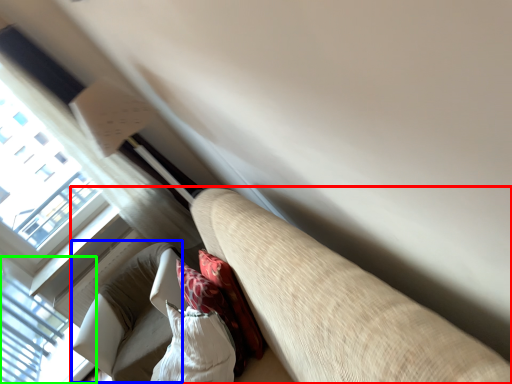
Question: Estimate the real-world distances between objects in this image. Which object is farther from studio couch (highlighted by a red box), bean bag chair (highlighted by a blue box) or window (highlighted by a green box)?

Choices:
 (A) bean bag chair
 (B) window

Answer: (B)